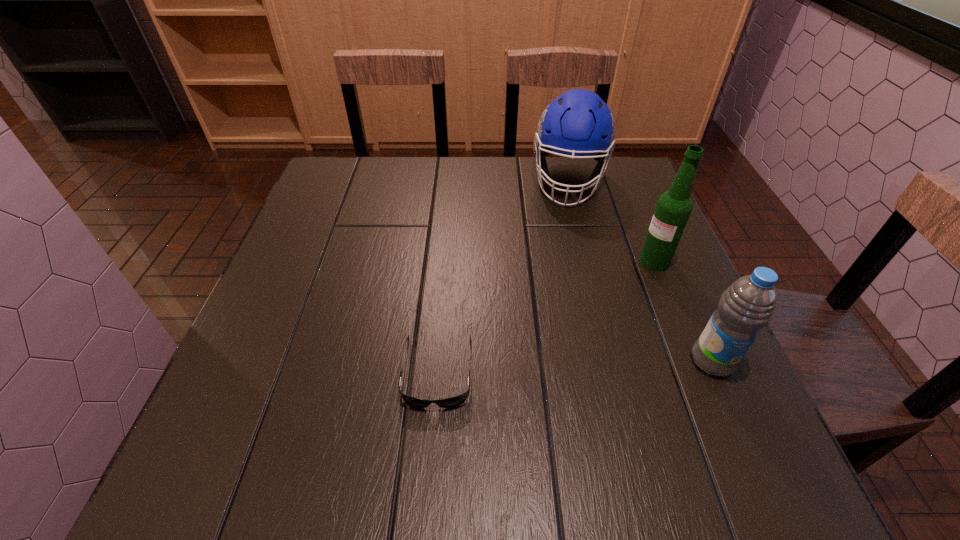
Locate an element on the screen. vacant space situated 0.200m on the face guard of the farthest object is located at coordinates (563, 264).

Find the location of `free space located 0.210m on the face guard of the farthest object`. free space located 0.210m on the face guard of the farthest object is located at coordinates (563, 266).

Image resolution: width=960 pixels, height=540 pixels. In order to click on vacant space situated 0.300m on the face guard of the farthest object in this screenshot , I will do `click(559, 295)`.

Where is `object that is positioned at the far edge`? Image resolution: width=960 pixels, height=540 pixels. object that is positioned at the far edge is located at coordinates (579, 123).

Where is `sunglasses that is at the near edge`? The width and height of the screenshot is (960, 540). sunglasses that is at the near edge is located at coordinates (458, 400).

You are a GUI agent. You are given a task and a screenshot of the screen. Output one action in this format:
    pyautogui.click(x=<x>, y=<y>)
    Task: Click on the water bottle situated at the near edge
    This screenshot has height=540, width=960.
    Given the screenshot: What is the action you would take?
    pyautogui.click(x=748, y=305)

The width and height of the screenshot is (960, 540). I want to click on water bottle at the right edge, so [748, 305].

Where is `beer bottle positioned at the right edge`? beer bottle positioned at the right edge is located at coordinates click(x=673, y=208).

Identify the location of football helmet situated at the right edge. tap(579, 123).

Locate an element on the screen. This screenshot has height=540, width=960. object situated at the far right corner is located at coordinates (579, 123).